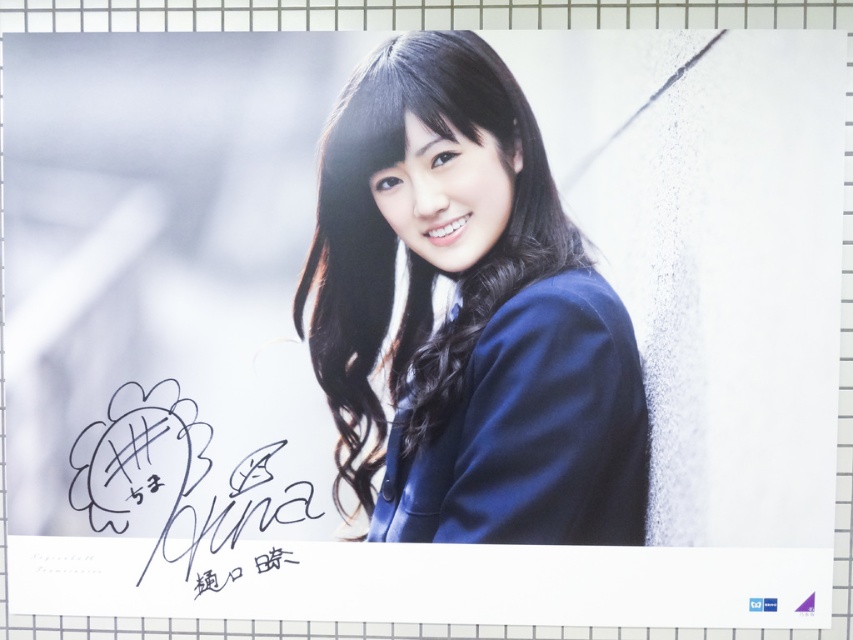
Question: Which point is farther from the camera taking this photo?

Choices:
 (A) (469, 499)
 (B) (564, 300)

Answer: (A)

Question: Which of these objects is positioned farthest from the blue fabric jacket at center?

Choices:
 (A) black ink signature at lower left
 (B) matte blue blazer at center

Answer: (A)

Question: Is matte blue blazer at center in front of black ink signature at lower left?

Choices:
 (A) no
 (B) yes

Answer: (B)

Question: Does blue fabric jacket at center lie in front of black ink signature at lower left?

Choices:
 (A) no
 (B) yes

Answer: (B)

Question: Does blue fabric jacket at center have a greater width compared to black ink signature at lower left?

Choices:
 (A) yes
 (B) no

Answer: (A)

Question: Considering the real-world distances, which object is closest to the blue fabric jacket at center?

Choices:
 (A) black ink signature at lower left
 (B) matte blue blazer at center

Answer: (B)